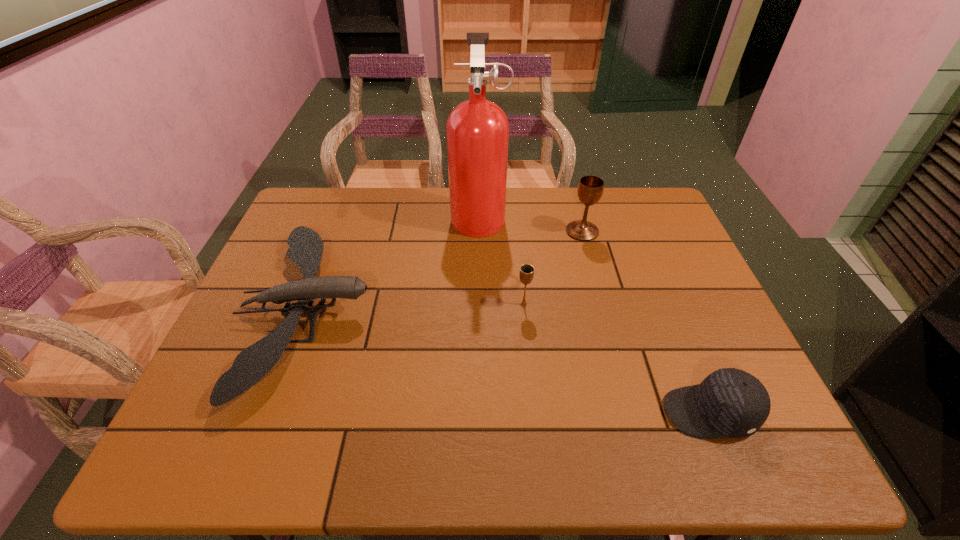
You are a GUI agent. You are given a task and a screenshot of the screen. Output one action in this format:
    pyautogui.click(x=<x>, y=<y>)
    Task: Click on the object at the near right corner
    This screenshot has height=540, width=960.
    Given the screenshot: What is the action you would take?
    pyautogui.click(x=729, y=403)

Find the location of a particular element. vacant space at the far edge of the desktop is located at coordinates (610, 202).

The height and width of the screenshot is (540, 960). In the image, there is a desktop. Identify the location of vacant space at the near edge. (312, 460).

In the image, there is a desktop. In order to click on vacant space at the left edge in this screenshot , I will do `click(273, 307)`.

Where is `free spot at the right edge of the desktop`? free spot at the right edge of the desktop is located at coordinates (647, 232).

Where is `vacant space at the far left corner of the desktop`? This screenshot has height=540, width=960. vacant space at the far left corner of the desktop is located at coordinates (350, 190).

In the image, there is a desktop. Where is `free region at the far right corner`? Image resolution: width=960 pixels, height=540 pixels. free region at the far right corner is located at coordinates (652, 212).

This screenshot has height=540, width=960. What are the coordinates of `free space at the near right corner of the desktop` in the screenshot? It's located at (768, 450).

Where is `free space between the rightmost object and the taller chalice`? free space between the rightmost object and the taller chalice is located at coordinates (646, 322).

Where is `empty space that is in between the drone and the rightmost object`? The image size is (960, 540). empty space that is in between the drone and the rightmost object is located at coordinates (509, 362).